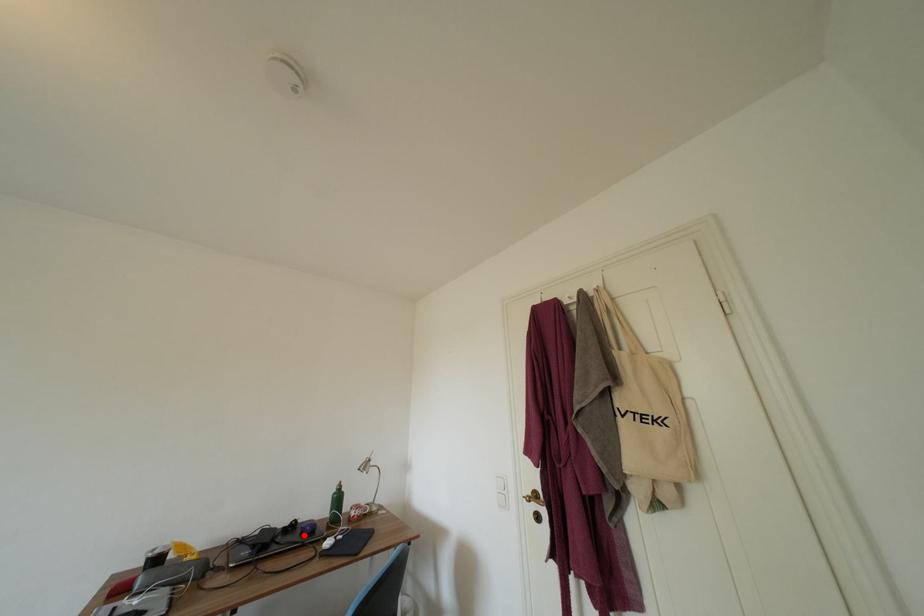
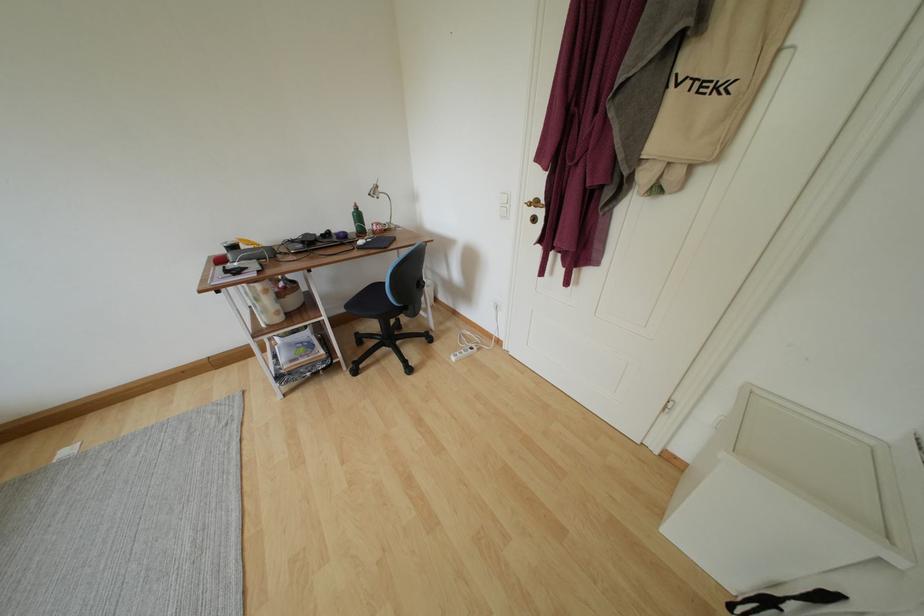
In the second image, find the point that corresponds to the highlighted location in the first image.

(339, 241)